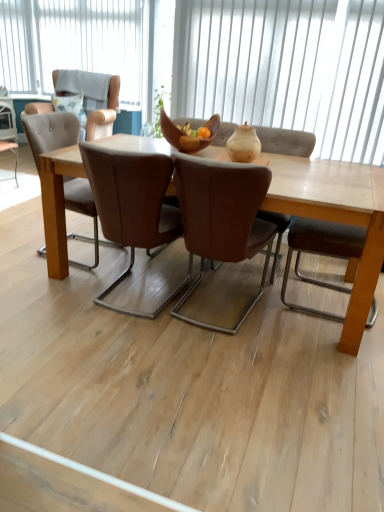
Question: From a real-world perspective, is white vertical blinds at upper center, the second window positioned from the top, on top of wooden bowl at center?

Choices:
 (A) no
 (B) yes

Answer: (B)

Question: Is white vertical blinds at upper center, which appears as the first window when viewed from the right, behind wooden bowl at center?

Choices:
 (A) yes
 (B) no

Answer: (A)

Question: Can you confirm if white vertical blinds at upper center, which appears as the first window when viewed from the right, is smaller than wooden bowl at center?

Choices:
 (A) yes
 (B) no

Answer: (B)

Question: Is white vertical blinds at upper center, the 2th window positioned from the back, thinner than wooden bowl at center?

Choices:
 (A) yes
 (B) no

Answer: (A)

Question: Is white vertical blinds at upper center, the second window positioned from the top, wider than wooden bowl at center?

Choices:
 (A) yes
 (B) no

Answer: (B)

Question: Would you say light brown leather armchair at upper left is to the left or to the right of white vertical blinds at upper center, which is the 1th window from bottom to top, in the picture?

Choices:
 (A) left
 (B) right

Answer: (A)

Question: From their relative heights in the image, would you say light brown leather armchair at upper left is taller or shorter than white vertical blinds at upper center, the second window positioned from the top?

Choices:
 (A) short
 (B) tall

Answer: (A)

Question: From a real-world perspective, is light brown leather armchair at upper left above or below white vertical blinds at upper center, which is the 1th window from bottom to top?

Choices:
 (A) above
 (B) below

Answer: (B)

Question: Considering the positions of light brown leather armchair at upper left and white vertical blinds at upper center, which appears as the first window when viewed from the right, in the image, is light brown leather armchair at upper left wider or thinner than white vertical blinds at upper center, which appears as the first window when viewed from the right,?

Choices:
 (A) wide
 (B) thin

Answer: (A)

Question: Is point (208, 112) positioned closer to the camera than point (57, 61)?

Choices:
 (A) closer
 (B) farther

Answer: (A)

Question: From a real-world perspective, is white vertical blinds at upper center, the 2th window positioned from the back, above or below white vertical blinds at upper center, placed as the second window when sorted from bottom to top?

Choices:
 (A) above
 (B) below

Answer: (B)

Question: Choose the correct answer: Is white vertical blinds at upper center, arranged as the second window when viewed from the left, inside white vertical blinds at upper center, the 1th window from the top, or outside it?

Choices:
 (A) outside
 (B) inside

Answer: (A)

Question: In the image, is white vertical blinds at upper center, which appears as the 1th window when viewed from the front, positioned in front of or behind white vertical blinds at upper center, which ranks as the second window in front-to-back order?

Choices:
 (A) front
 (B) behind

Answer: (A)

Question: From the image's perspective, is brown leather chair at center, which is counted as the 1th chair, starting from the right, located above or below white vertical blinds at upper center, which appears as the first window when viewed from the right?

Choices:
 (A) above
 (B) below

Answer: (B)

Question: In terms of height, does brown leather chair at center, which is the 2th chair in left-to-right order, look taller or shorter compared to white vertical blinds at upper center, arranged as the second window when viewed from the left?

Choices:
 (A) short
 (B) tall

Answer: (A)